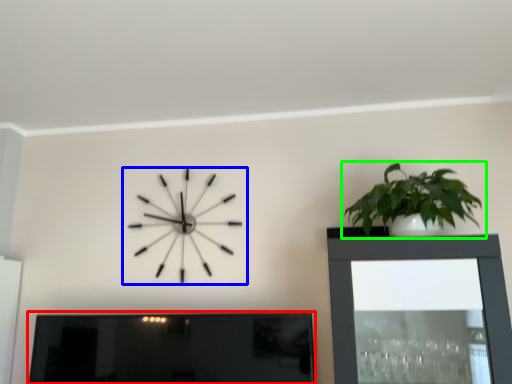
Question: Which object is positioned farthest from picture frame (highlighted by a red box)? Select from wall clock (highlighted by a blue box) and houseplant (highlighted by a green box).

Choices:
 (A) wall clock
 (B) houseplant

Answer: (B)